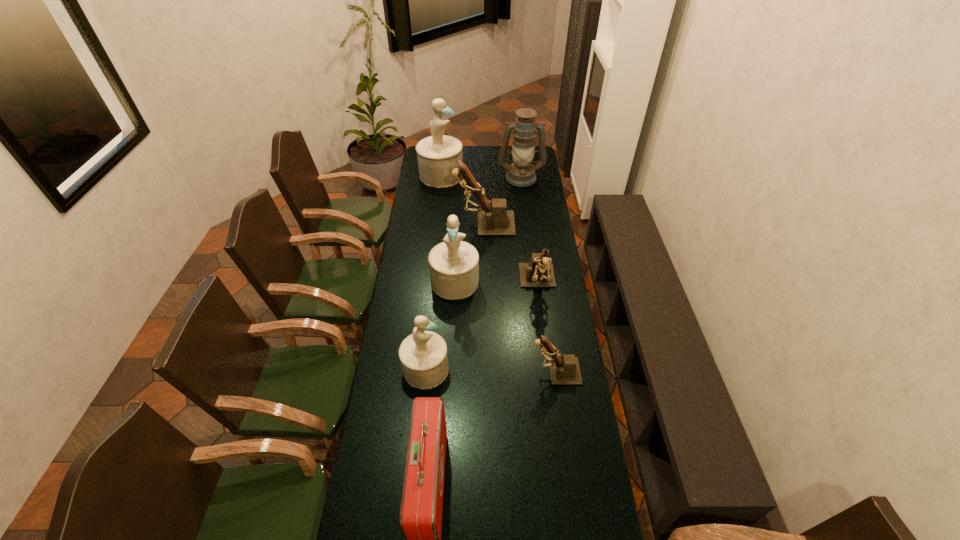
I want to click on vacant area located at the beak of the farthest white figurine, so click(x=479, y=175).

This screenshot has height=540, width=960. What are the coordinates of `free space located 0.200m on the front of the oil lamp` in the screenshot? It's located at (524, 208).

Where is `free spot located 0.120m at the beak of the second farthest white figurine`? The height and width of the screenshot is (540, 960). free spot located 0.120m at the beak of the second farthest white figurine is located at coordinates (453, 322).

The image size is (960, 540). Identify the location of free space located on the front-facing side of the third farthest object. (444, 224).

Where is `vacant region located 0.050m on the front-facing side of the third farthest object`? The height and width of the screenshot is (540, 960). vacant region located 0.050m on the front-facing side of the third farthest object is located at coordinates (444, 224).

This screenshot has width=960, height=540. I want to click on vacant space located on the front-facing side of the third farthest object, so click(x=416, y=224).

Image resolution: width=960 pixels, height=540 pixels. Find the location of `vacant region located 0.070m at the beak of the smallest white figurine`. vacant region located 0.070m at the beak of the smallest white figurine is located at coordinates (468, 369).

You are a GUI agent. You are given a task and a screenshot of the screen. Output one action in this format:
    pyautogui.click(x=<x>, y=<y>)
    Task: Click on the vacant space located 0.080m on the front-facing side of the second nearest brown figurine
    The height and width of the screenshot is (540, 960).
    Given the screenshot: What is the action you would take?
    pyautogui.click(x=542, y=319)

Identify the location of vacant area situated 0.320m on the front-facing side of the shortest object. (445, 372).

Locate an element on the screen. This screenshot has width=960, height=540. vacant space located on the front-facing side of the shortest object is located at coordinates (435, 372).